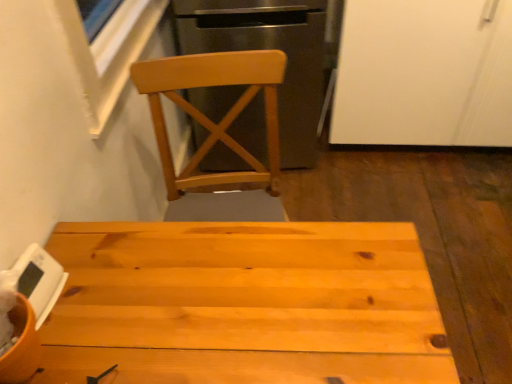
Question: Considering the relative sizes of light wood chair at upper center and white matte cabinet at upper right in the image provided, is light wood chair at upper center wider than white matte cabinet at upper right?

Choices:
 (A) no
 (B) yes

Answer: (A)

Question: From the image's perspective, is light wood chair at upper center below white matte cabinet at upper right?

Choices:
 (A) no
 (B) yes

Answer: (B)

Question: Is light wood chair at upper center shorter than white matte cabinet at upper right?

Choices:
 (A) no
 (B) yes

Answer: (A)

Question: From a real-world perspective, does light wood chair at upper center stand above white matte cabinet at upper right?

Choices:
 (A) no
 (B) yes

Answer: (B)

Question: Are light wood chair at upper center and white matte cabinet at upper right located far from each other?

Choices:
 (A) no
 (B) yes

Answer: (A)

Question: Is white matte cabinet at upper right inside the boundaries of white matte digital clock at lower left, or outside?

Choices:
 (A) inside
 (B) outside

Answer: (B)

Question: Is point (467, 18) closer or farther from the camera than point (55, 296)?

Choices:
 (A) farther
 (B) closer

Answer: (A)

Question: Visually, is white matte cabinet at upper right positioned to the left or to the right of white matte digital clock at lower left?

Choices:
 (A) right
 (B) left

Answer: (A)

Question: From the image's perspective, is white matte cabinet at upper right located above or below white matte digital clock at lower left?

Choices:
 (A) above
 (B) below

Answer: (A)

Question: Does point (356, 142) appear closer or farther from the camera than point (186, 278)?

Choices:
 (A) closer
 (B) farther

Answer: (B)

Question: Would you say white matte cabinet at upper right is to the left or to the right of natural wood table at center in the picture?

Choices:
 (A) right
 (B) left

Answer: (A)

Question: In the image, is white matte cabinet at upper right positioned in front of or behind natural wood table at center?

Choices:
 (A) front
 (B) behind

Answer: (B)

Question: Considering the positions of white matte cabinet at upper right and natural wood table at center in the image, is white matte cabinet at upper right taller or shorter than natural wood table at center?

Choices:
 (A) tall
 (B) short

Answer: (A)

Question: In the image, is natural wood table at center positioned in front of or behind white matte cabinet at upper right?

Choices:
 (A) behind
 (B) front

Answer: (B)

Question: From the image's perspective, is natural wood table at center located above or below white matte cabinet at upper right?

Choices:
 (A) above
 (B) below

Answer: (B)